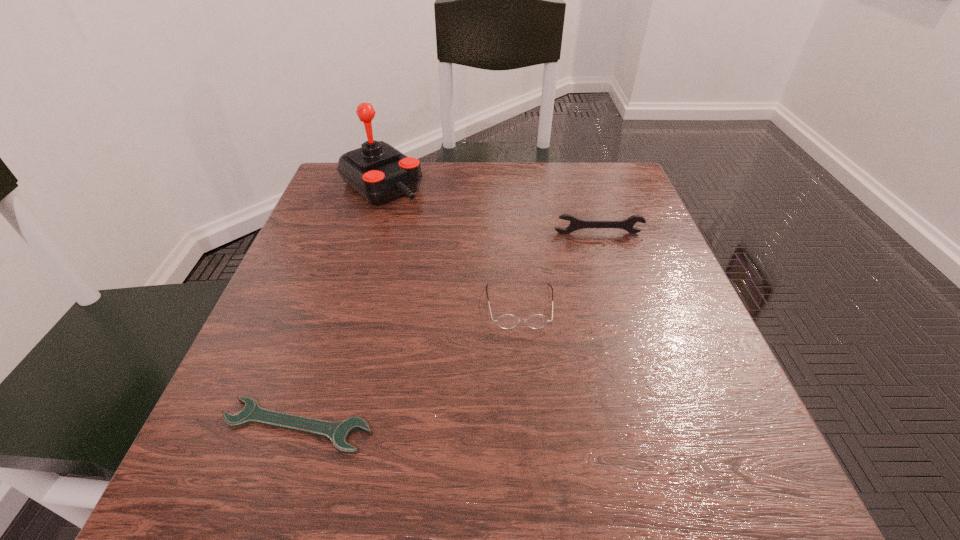
The height and width of the screenshot is (540, 960). Identify the location of vacant area that lies between the third tallest object and the left wrench. (408, 366).

I want to click on free space between the joystick and the right wrench, so click(x=490, y=210).

This screenshot has height=540, width=960. In order to click on free point between the second object from right to left and the third shortest object in this screenshot , I will do `click(559, 269)`.

The width and height of the screenshot is (960, 540). I want to click on vacant space in between the second shortest object and the farther wrench, so click(559, 269).

Where is `vacant space in between the shorter wrench and the joystick`? vacant space in between the shorter wrench and the joystick is located at coordinates (339, 306).

Identify which object is located as the third nearest to the shorter wrench. Please provide its 2D coordinates. Your answer should be formatted as a tuple, i.e. [(x, y)], where the tuple contains the x and y coordinates of a point satisfying the conditions above.

[(575, 224)]

I want to click on object identified as the second closest to the spectacles, so click(x=338, y=432).

Where is `vacant space that satisfies the following two spatial constraints: 1. on the back side of the nearest object; 2. on the left side of the tallest object`? The height and width of the screenshot is (540, 960). vacant space that satisfies the following two spatial constraints: 1. on the back side of the nearest object; 2. on the left side of the tallest object is located at coordinates (375, 186).